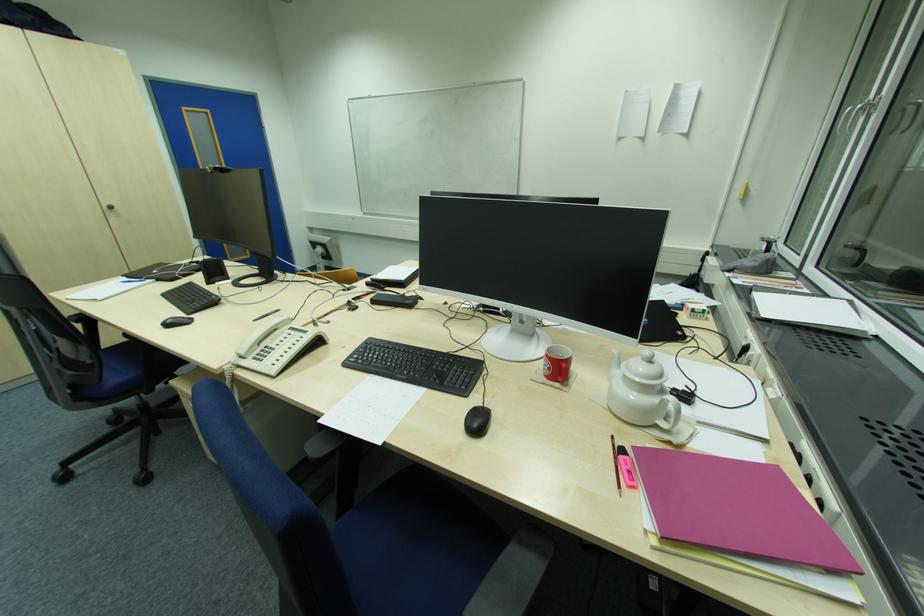
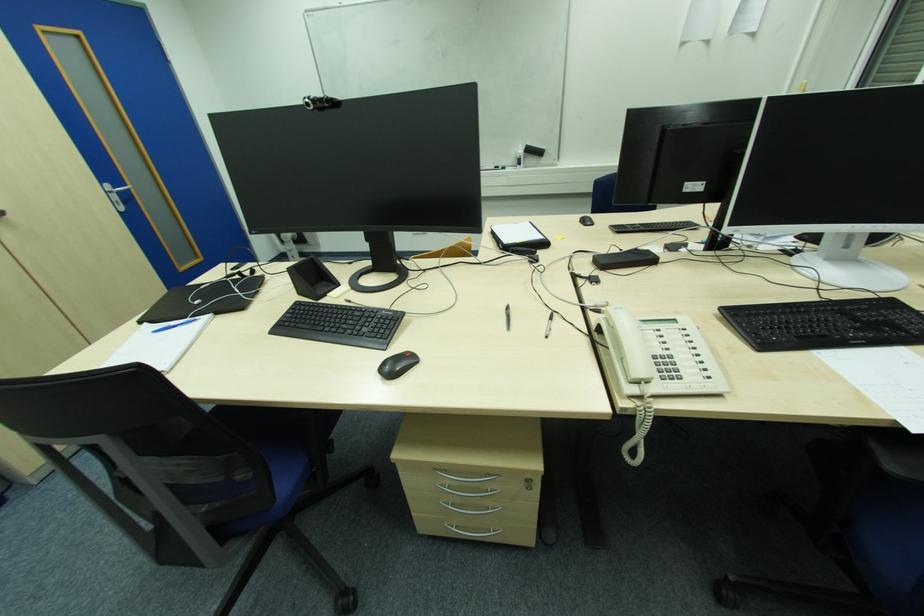
Locate, in the second image, the point that corresponds to the point at 280,312 in the first image.

(509, 309)